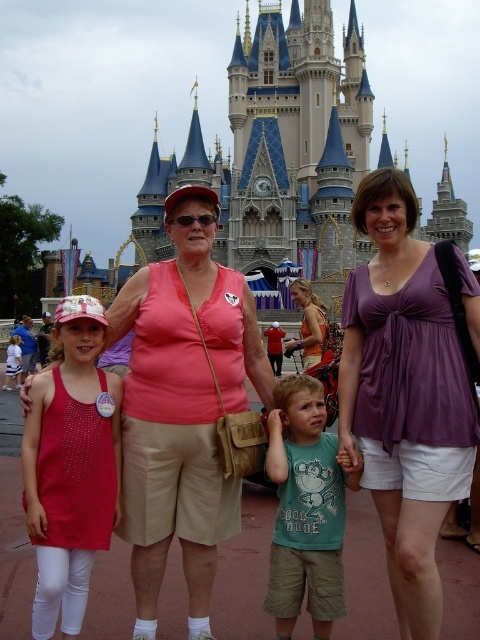
Which is above, pink fabric shirt at center or teal cotton shirt at center?

pink fabric shirt at center is above.

Image resolution: width=480 pixels, height=640 pixels. Identify the location of pink fabric shirt at center. click(x=398, y=333).

Identify the location of pink fabric shirt at center. (398, 333).

The image size is (480, 640). I want to click on pink fabric shirt at center, so click(398, 333).

Which is above, pink fabric shirt at center or purple fabric blouse at center?

purple fabric blouse at center

Is point (412, 200) positioned before point (468, 412)?

No, (412, 200) is further to viewer.

The image size is (480, 640). Find the location of `pink fabric shirt at center`. pink fabric shirt at center is located at coordinates (398, 333).

Who is positioned more to the right, blue stone castle at center or pink fabric shirt at center?

Positioned to the right is blue stone castle at center.

Does blue stone castle at center lie behind pink fabric shirt at center?

Yes, it is.

Which is behind, point (368, 134) or point (384, 353)?

Point (368, 134)

Locate an element on the screen. blue stone castle at center is located at coordinates (278, 150).